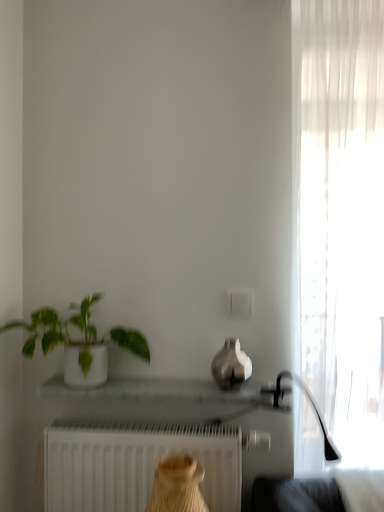
Describe the element at coordinates (135, 463) in the screenshot. The width and height of the screenshot is (384, 512). I see `white matte radiator at lower center` at that location.

Where is `white matte radiator at lower center`? white matte radiator at lower center is located at coordinates (135, 463).

What do you see at coordinates (231, 365) in the screenshot? I see `satin silver vase at center` at bounding box center [231, 365].

The image size is (384, 512). What do you see at coordinates (156, 390) in the screenshot?
I see `white glossy tray at center` at bounding box center [156, 390].

Find the location of a particular element. white matte radiator at lower center is located at coordinates (135, 463).

Which is nearer, (185, 382) or (202, 449)?

Point (202, 449)

How distant is white glossy tray at center from white matte radiator at lower center?

The distance of white glossy tray at center from white matte radiator at lower center is 17.59 centimeters.

From a real-world perspective, between white glossy tray at center and white matte radiator at lower center, who is vertically higher?

white glossy tray at center.

Is white glossy tray at center in front of or behind white matte radiator at lower center in the image?

In the image, white glossy tray at center appears in front of white matte radiator at lower center.

Consider the image. Which of these two, white glossy pot at left or white matte radiator at lower center, stands shorter?

With less height is white glossy pot at left.

From the image's perspective, which one is positioned lower, white glossy pot at left or white matte radiator at lower center?

white matte radiator at lower center.

Based on the photo, considering the sizes of objects white glossy pot at left and white matte radiator at lower center in the image provided, who is thinner, white glossy pot at left or white matte radiator at lower center?

white matte radiator at lower center.

Based on their positions, is white glossy pot at left located to the left or right of white matte radiator at lower center?

white glossy pot at left is to the left of white matte radiator at lower center.

Which object is positioned more to the right, white sheer curtain at right or white glossy tray at center?

white sheer curtain at right.

Could white glossy tray at center be considered to be inside white sheer curtain at right?

No, white glossy tray at center is not a part of white sheer curtain at right.

Is white sheer curtain at right positioned far away from white glossy tray at center?

white sheer curtain at right is actually quite close to white glossy tray at center.

Measure the distance from white sheer curtain at right to white glossy tray at center.

white sheer curtain at right and white glossy tray at center are 20.85 inches apart from each other.

Which is more to the left, white glossy tray at center or satin silver vase at center?

Positioned to the left is white glossy tray at center.

Based on the photo, is white glossy tray at center taller than satin silver vase at center?

Incorrect, the height of white glossy tray at center is not larger of that of satin silver vase at center.

In the scene shown: Is white glossy tray at center inside or outside of satin silver vase at center?

white glossy tray at center exists outside the volume of satin silver vase at center.

Identify the location of window sill below the satin silver vase at center (from the image's perspective). [156, 390].

Would you say white glossy pot at left contains white sheer curtain at right?

No.

From the image's perspective, would you say white glossy pot at left is positioned over white sheer curtain at right?

No, from the image's perspective, white glossy pot at left is not above white sheer curtain at right.

Considering the sizes of objects white glossy pot at left and white sheer curtain at right in the image provided, who is shorter, white glossy pot at left or white sheer curtain at right?

white glossy pot at left.

Where is `houseplant lying on the left of white sheer curtain at right`? The image size is (384, 512). houseplant lying on the left of white sheer curtain at right is located at coordinates (78, 341).

Can you confirm if white glossy tray at center is shorter than white sheer curtain at right?

Yes.

Who is bigger, white glossy tray at center or white sheer curtain at right?

Bigger between the two is white sheer curtain at right.

Which is more to the right, white glossy tray at center or white sheer curtain at right?

From the viewer's perspective, white sheer curtain at right appears more on the right side.

Is white glossy tray at center not close to white sheer curtain at right?

They are positioned close to each other.

From their relative heights in the image, would you say white matte radiator at lower center is taller or shorter than white glossy pot at left?

Considering their sizes, white matte radiator at lower center has more height than white glossy pot at left.

At what (x,y) coordinates should I click in order to perform the action: click on houseplant in front of the white matte radiator at lower center. Please return your answer as a coordinate pair (x, y). Image resolution: width=384 pixels, height=512 pixels. Looking at the image, I should click on (78, 341).

Does white matte radiator at lower center have a greater width compared to white glossy pot at left?

No, white matte radiator at lower center is not wider than white glossy pot at left.

Could you tell me if white matte radiator at lower center is turned towards white glossy pot at left?

No, white matte radiator at lower center is not aimed at white glossy pot at left.

Where is `window sill lying in front of the white matte radiator at lower center`? window sill lying in front of the white matte radiator at lower center is located at coordinates (156, 390).

The width and height of the screenshot is (384, 512). Find the location of `houseplant that is above the white matte radiator at lower center (from the image's perspective)`. houseplant that is above the white matte radiator at lower center (from the image's perspective) is located at coordinates (78, 341).

When comparing their distances from white glossy tray at center, does white glossy pot at left or white sheer curtain at right seem closer?

white glossy pot at left.

Based on the photo, looking at the image, which one is located further to satin silver vase at center, white sheer curtain at right or white glossy tray at center?

white sheer curtain at right is further to satin silver vase at center.

Which object lies nearer to the anchor point white glossy tray at center, satin silver vase at center or white matte radiator at lower center?

The object closer to white glossy tray at center is satin silver vase at center.

Based on their spatial positions, is white matte radiator at lower center or white glossy tray at center further from white glossy pot at left?

The object further to white glossy pot at left is white matte radiator at lower center.

Looking at the image, which one is located closer to satin silver vase at center, white matte radiator at lower center or white glossy pot at left?

white matte radiator at lower center lies closer to satin silver vase at center than the other object.

Which object lies further to the anchor point white matte radiator at lower center, white glossy tray at center or white glossy pot at left?

white glossy pot at left is positioned further to the anchor white matte radiator at lower center.

Looking at the image, which one is located closer to white glossy tray at center, white matte radiator at lower center or white sheer curtain at right?

Based on the image, white matte radiator at lower center appears to be nearer to white glossy tray at center.

Based on their spatial positions, is white matte radiator at lower center or white sheer curtain at right further from white glossy pot at left?

white sheer curtain at right lies further to white glossy pot at left than the other object.

The height and width of the screenshot is (512, 384). Find the location of `vase located between white glossy tray at center and white sheer curtain at right in the left-right direction`. vase located between white glossy tray at center and white sheer curtain at right in the left-right direction is located at coordinates (231, 365).

Find the location of a particular element. This screenshot has height=512, width=384. radiator between white glossy tray at center and white sheer curtain at right from left to right is located at coordinates (135, 463).

Find the location of `vase located between white glossy pot at left and white sheer curtain at right in the left-right direction`. vase located between white glossy pot at left and white sheer curtain at right in the left-right direction is located at coordinates [231, 365].

What are the coordinates of `vase that lies between white glossy pot at left and white matte radiator at lower center from top to bottom` in the screenshot? It's located at (231, 365).